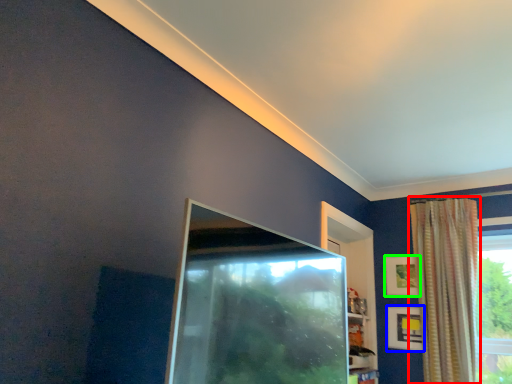
Question: Which is nearer to the curtain (highlighted by a red box)? picture frame (highlighted by a blue box) or picture frame (highlighted by a green box).

Choices:
 (A) picture frame
 (B) picture frame

Answer: (B)